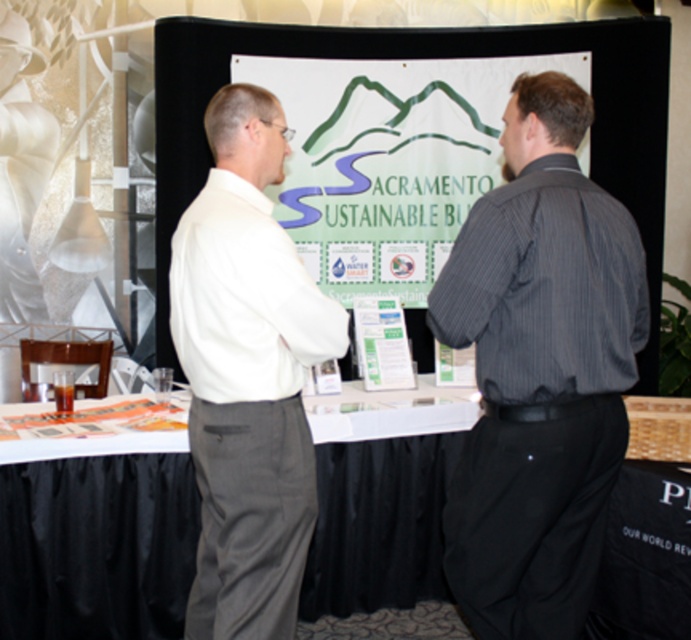
You are a photographer at the event and need to ensure that both the dark gray striped shirt at center and the white cotton shirt at center are fully visible in your photo. Given their sizes, which shirt should you focus on framing first to accommodate both in the shot?

The dark gray striped shirt at center is smaller than the white cotton shirt at center, so you should focus on framing the white cotton shirt at center first to ensure it fits properly, then adjust the shot to include the smaller dark gray striped shirt at center.